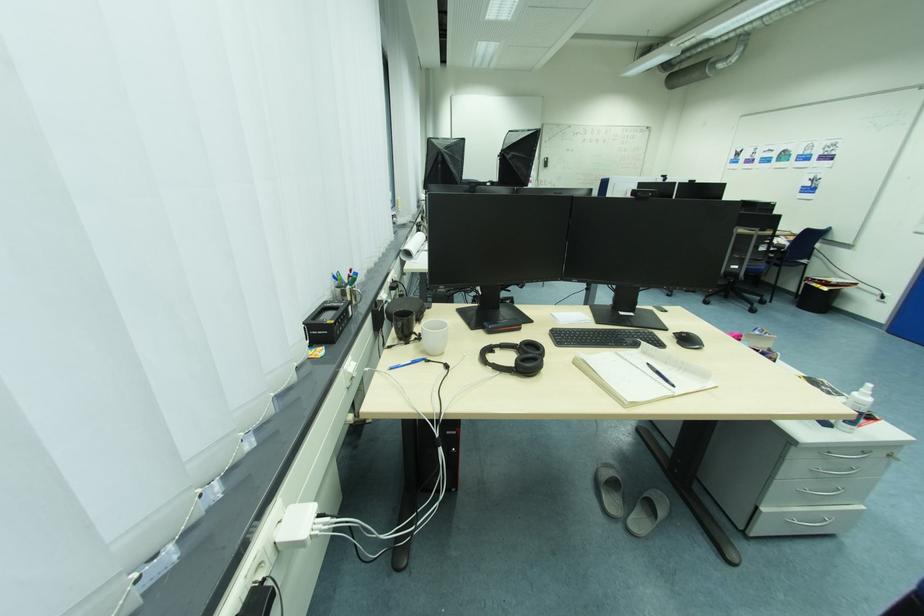
The height and width of the screenshot is (616, 924). What are the coordinates of `white spray bottle` in the screenshot? It's located at (857, 407).